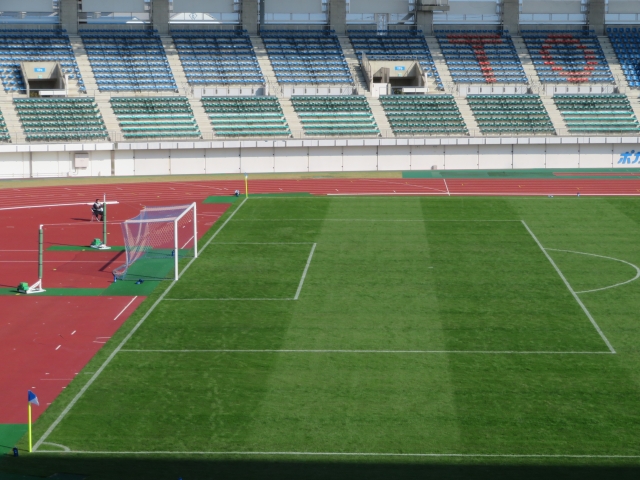
At what (x,y) coordinates should I click in order to perform the action: click on seating. Please return your answer as a coordinate pair (x, y). The width and height of the screenshot is (640, 480). Looking at the image, I should click on (420, 112).